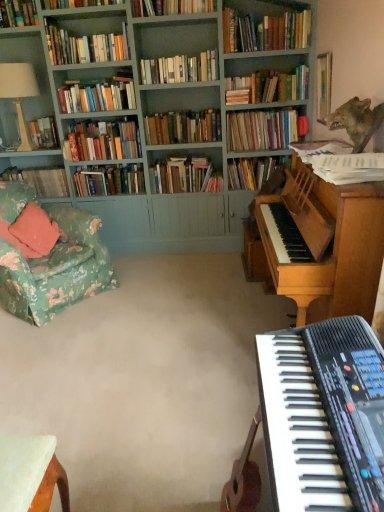
In order to click on vacant area that is in front of floral fabric chair at left in this screenshot , I will do `click(57, 348)`.